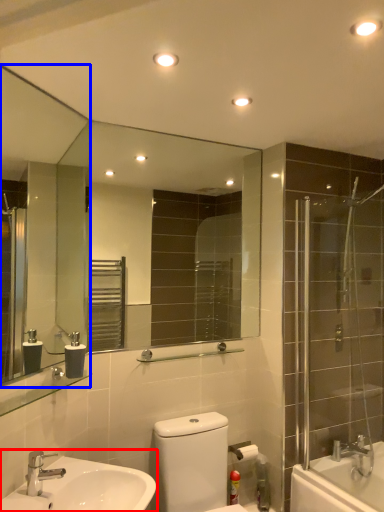
Question: Which of the following is the closest to the observer, sink (highlighted by a red box) or mirror (highlighted by a blue box)?

Choices:
 (A) sink
 (B) mirror

Answer: (A)